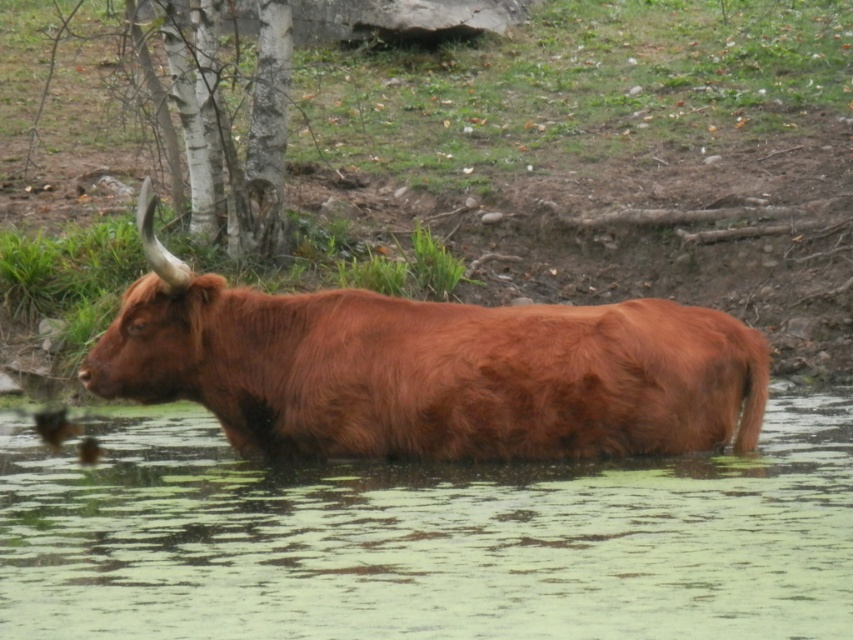
From the picture: You are a photographer trying to capture the Highland cow in the image. You want to ensure the green algae water at lower center and the bark textured tree at upper left are both visible in your shot. Which object should you focus on to frame the scene properly?

The green algae water at lower center should be the focus since its width is larger than the bark textured tree at upper left, making it a more prominent feature in the scene.

You are a photographer standing 10 meters away from a brown furry yak at center. You want to take a closeup photo of it. Do you think you can get a clear closeup shot without moving closer? Your camera has a maximum zoom range of 5 meters.

The brown furry yak at center is 7.55 meters away from the camera. Since your camera can zoom up to 5 meters, you need to move closer by 2.55 meters to capture a clear closeup.